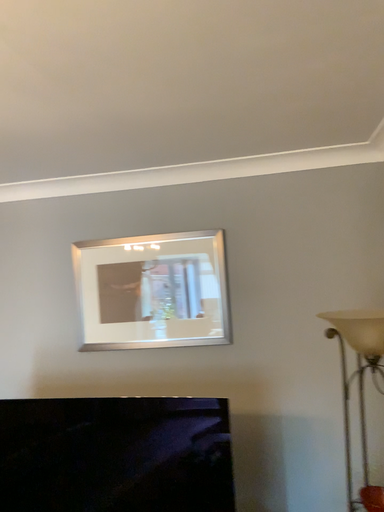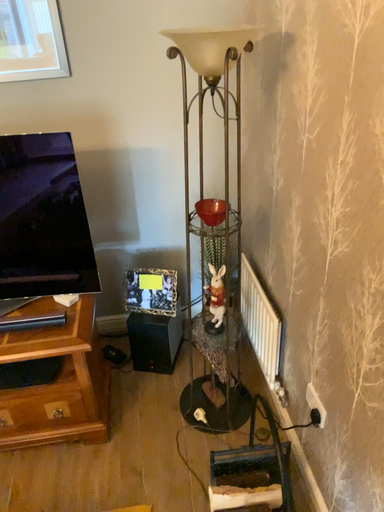
Question: Which way did the camera rotate in the video?

Choices:
 (A) rotated downward
 (B) rotated upward

Answer: (A)